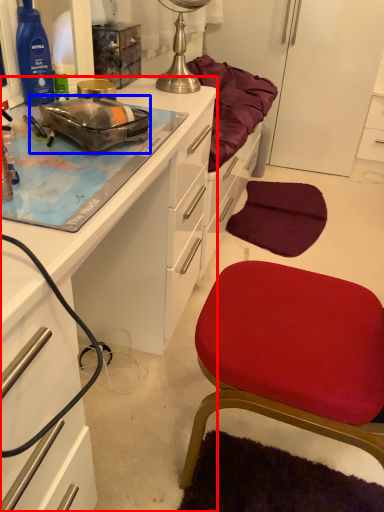
Question: Which object is further to the camera taking this photo, cabinetry (highlighted by a red box) or appliance (highlighted by a blue box)?

Choices:
 (A) cabinetry
 (B) appliance

Answer: (B)